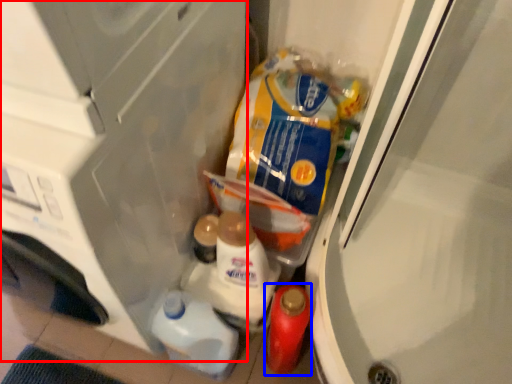
Question: Which object appears farthest to the camera in this image, appliance (highlighted by a red box) or bottle (highlighted by a blue box)?

Choices:
 (A) appliance
 (B) bottle

Answer: (B)